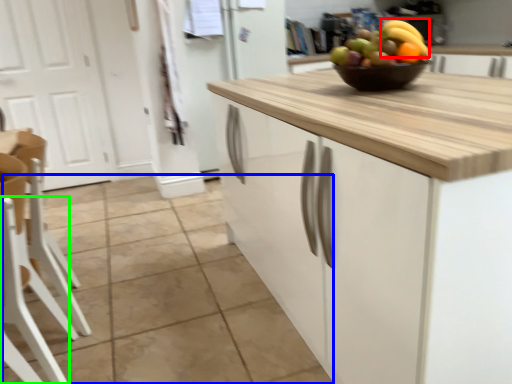
Question: Which object is positioned closest to banana (highlighted by a red box)? Select from tile (highlighted by a blue box) and chair (highlighted by a green box).

Choices:
 (A) tile
 (B) chair

Answer: (B)